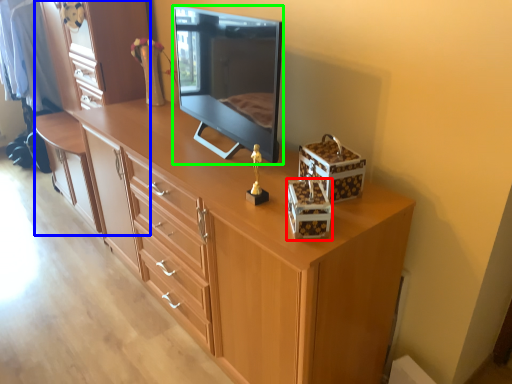
Question: Which is farther away from storage box (highlighted by a red box)? dresser (highlighted by a blue box) or television (highlighted by a green box)?

Choices:
 (A) dresser
 (B) television

Answer: (A)